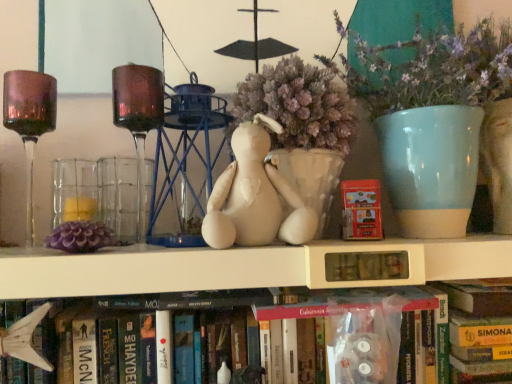
Describe the element at coordinates (255, 196) in the screenshot. I see `white fabric stuffed animal at center` at that location.

Image resolution: width=512 pixels, height=384 pixels. What do you see at coordinates (138, 117) in the screenshot? I see `translucent glass candle holder at left` at bounding box center [138, 117].

What is the approximate height of hardcover book at lower center, the 2th book from the left?

hardcover book at lower center, the 2th book from the left, is 22.32 centimeters in height.

Locate an element on the screen. This screenshot has height=384, width=512. white matte shelf at center is located at coordinates (241, 267).

This screenshot has width=512, height=384. Describe the element at coordinates (323, 316) in the screenshot. I see `hardcover book at center, the 1th book positioned from the left` at that location.

Locate an element on the screen. The image size is (512, 384). matte red paperback book at center is located at coordinates (361, 210).

What's the angular difference between white fabric stuffed animal at center and translucent glass candle holder at left's facing directions?

There is a 0.987-degree angle between the facing directions of white fabric stuffed animal at center and translucent glass candle holder at left.

Is white fabric stuffed animal at center further to the viewer compared to translucent glass candle holder at left?

No.

From a real-world perspective, is white fabric stuffed animal at center physically located above or below translucent glass candle holder at left?

Clearly, from a real-world perspective, white fabric stuffed animal at center is below translucent glass candle holder at left.

Is matte ceramic vase at upper right surrounding matte red paperback book at center?

Yes, matte ceramic vase at upper right contains matte red paperback book at center.

Are matte ceramic vase at upper right and matte red paperback book at center making contact?

No, matte ceramic vase at upper right is not beside matte red paperback book at center.

In the scene shown: From the image's perspective, between matte ceramic vase at upper right and matte red paperback book at center, which one is located above?

matte ceramic vase at upper right is shown above in the image.

Is matte ceramic vase at upper right bigger than matte red paperback book at center?

Correct, matte ceramic vase at upper right is larger in size than matte red paperback book at center.

Find the location of a particular element. shelf that appears above the hardcover book at center, the 1th book positioned from the left (from the image's perspective) is located at coordinates (241, 267).

Would you say white matte shelf at center is inside or outside hardcover book at center, marked as the 2th book in a right-to-left arrangement?

white matte shelf at center lies outside hardcover book at center, marked as the 2th book in a right-to-left arrangement.

Would you say white matte shelf at center is a long distance from hardcover book at center, marked as the 2th book in a right-to-left arrangement?

No, white matte shelf at center is not far from hardcover book at center, marked as the 2th book in a right-to-left arrangement.

Is amber glass wine glass at left far away from translucent glass candle holder at left?

That's not correct — amber glass wine glass at left is a little close to translucent glass candle holder at left.

Is amber glass wine glass at left turned away from translucent glass candle holder at left?

That's not correct — amber glass wine glass at left is not looking away from translucent glass candle holder at left.

Is point (4, 122) positioned behind point (119, 76)?

Yes, it is.

Based on their sizes in the image, would you say amber glass wine glass at left is bigger or smaller than translucent glass candle holder at left?

Considering their sizes, amber glass wine glass at left takes up more space than translucent glass candle holder at left.

Between white matte shelf at center and matte red paperback book at center, which one has larger width?

Wider between the two is white matte shelf at center.

Considering the sizes of white matte shelf at center and matte red paperback book at center in the image, is white matte shelf at center taller or shorter than matte red paperback book at center?

In the image, white matte shelf at center appears to be shorter than matte red paperback book at center.

From the image's perspective, between white matte shelf at center and matte red paperback book at center, which one is located above?

matte red paperback book at center, from the image's perspective.

Between translucent glass candle holder at left and white fabric stuffed animal at center, which one has larger size?

With larger size is white fabric stuffed animal at center.

Consider the image. Between translucent glass candle holder at left and white fabric stuffed animal at center, which one is positioned in front?

white fabric stuffed animal at center is more forward.

From a real-world perspective, is translucent glass candle holder at left located beneath white fabric stuffed animal at center?

No.

From the picture: Is translucent glass candle holder at left at the left side of white fabric stuffed animal at center?

Indeed, translucent glass candle holder at left is positioned on the left side of white fabric stuffed animal at center.

At what (x,y) coordinates should I click in order to perform the action: click on paperback book lying above the white matte shelf at center (from the image's perspective). Please return your answer as a coordinate pair (x, y). Looking at the image, I should click on (361, 210).

Is matte red paperback book at center facing away from white matte shelf at center?

No, matte red paperback book at center's orientation is not away from white matte shelf at center.

Is matte red paperback book at center beside white matte shelf at center?

matte red paperback book at center and white matte shelf at center are clearly separated.

Identify the location of toy in front of the translucent glass candle holder at left. The height and width of the screenshot is (384, 512). (255, 196).

You are a GUI agent. You are given a task and a screenshot of the screen. Output one action in this format:
    pyautogui.click(x=<x>, y=<y>)
    Task: Click on the paperback book to the left of matte ceramic vase at upper right
    Image resolution: width=512 pixels, height=384 pixels.
    Given the screenshot: What is the action you would take?
    pyautogui.click(x=361, y=210)

Considering their positions, is white matte shelf at center positioned closer to white fabric stuffed animal at center than hardcover book at lower center, the first book in the right-to-left sequence?

white matte shelf at center.

Looking at the image, which one is located further to translucent glass candle holder at left, hardcover book at center, the 1th book positioned from the left, or matte ceramic vase at upper right?

matte ceramic vase at upper right is further to translucent glass candle holder at left.

Based on their spatial positions, is translucent glass candle holder at left or hardcover book at lower center, the first book in the right-to-left sequence, further from matte red paperback book at center?

Among the two, translucent glass candle holder at left is located further to matte red paperback book at center.

Estimate the real-world distances between objects in this image. Which object is closer to translucent glass candle holder at left, hardcover book at center, the 1th book positioned from the left, or amber glass wine glass at left?

amber glass wine glass at left is positioned closer to the anchor translucent glass candle holder at left.

Considering their positions, is amber glass wine glass at left positioned further to white matte shelf at center than hardcover book at lower center, the 2th book from the left?

amber glass wine glass at left is further to white matte shelf at center.

Based on their spatial positions, is hardcover book at lower center, the 2th book from the left, or white fabric stuffed animal at center further from matte ceramic vase at upper right?

Among the two, hardcover book at lower center, the 2th book from the left, is located further to matte ceramic vase at upper right.

Considering their positions, is hardcover book at center, marked as the 2th book in a right-to-left arrangement, positioned closer to matte red paperback book at center than amber glass wine glass at left?

hardcover book at center, marked as the 2th book in a right-to-left arrangement, lies closer to matte red paperback book at center than the other object.

Estimate the real-world distances between objects in this image. Which object is closer to matte ceramic vase at upper right, matte red paperback book at center or hardcover book at center, marked as the 2th book in a right-to-left arrangement?

Among the two, matte red paperback book at center is located nearer to matte ceramic vase at upper right.

Identify the location of shelf between amber glass wine glass at left and matte red paperback book at center from left to right. (241, 267).

The height and width of the screenshot is (384, 512). Identify the location of toy between translucent glass candle holder at left and white matte shelf at center in the horizontal direction. (255, 196).

This screenshot has height=384, width=512. Find the location of `toy between hardcover book at center, marked as the 2th book in a right-to-left arrangement, and hardcover book at lower center, the first book in the right-to-left sequence`. toy between hardcover book at center, marked as the 2th book in a right-to-left arrangement, and hardcover book at lower center, the first book in the right-to-left sequence is located at coordinates (255, 196).

The width and height of the screenshot is (512, 384). Identify the location of shelf between matte ceramic vase at upper right and hardcover book at lower center, the first book in the right-to-left sequence, in the vertical direction. (241, 267).